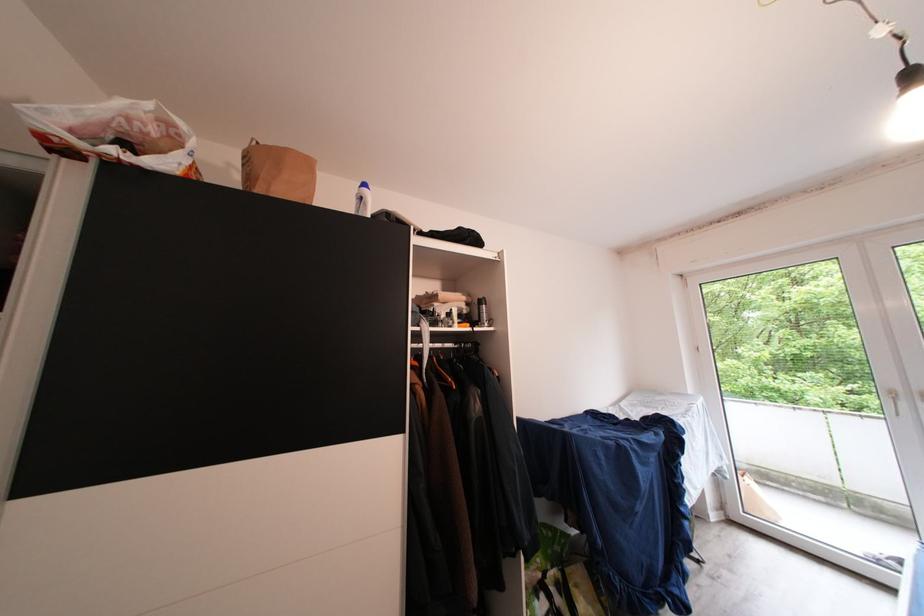
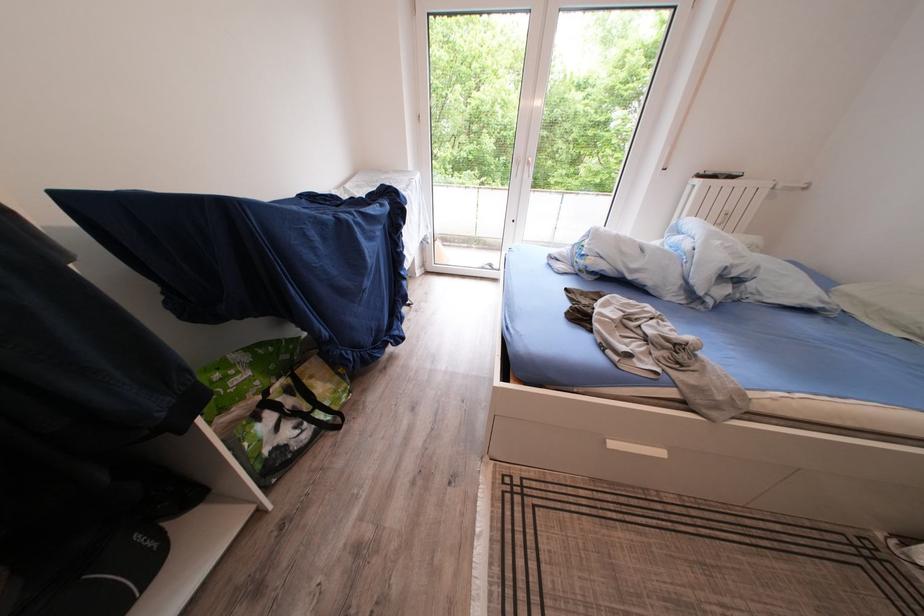
Find the pixel in the second image that matches pixel 549 581 in the first image.

(268, 403)